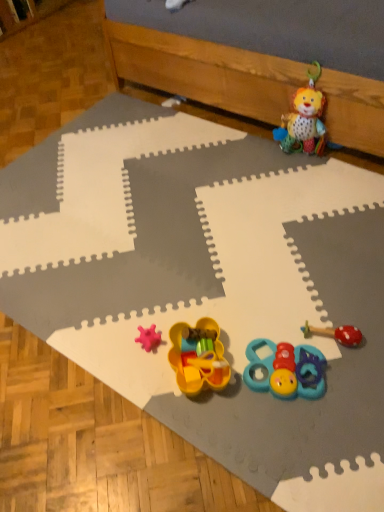
Where is `teal rubber teething toy at lower center, placed as the 1th toy when sorted from bottom to top`? teal rubber teething toy at lower center, placed as the 1th toy when sorted from bottom to top is located at coordinates (286, 370).

The height and width of the screenshot is (512, 384). I want to click on yellow plastic toy at center, which appears as the 3th toy when viewed from the top, so click(198, 357).

What do you see at coordinates (198, 357) in the screenshot? This screenshot has width=384, height=512. I see `yellow plastic toy at center, which appears as the 3th toy when viewed from the top` at bounding box center [198, 357].

Locate an element on the screen. This screenshot has height=512, width=384. teal rubber teething toy at lower center, acting as the 4th toy starting from the top is located at coordinates (286, 370).

Image resolution: width=384 pixels, height=512 pixels. I want to click on toy located above the red rubber teething ring at lower right, the 2th toy in the top-to-bottom sequence (from the image's perspective), so [x=304, y=119].

Measure the distance from plush fabric lion at upper right, the 4th toy in the front-to-back sequence, to red rubber teething ring at lower right, positioned as the third toy in bottom-to-top order.

plush fabric lion at upper right, the 4th toy in the front-to-back sequence, and red rubber teething ring at lower right, positioned as the third toy in bottom-to-top order, are 75.78 centimeters apart.

From the image's perspective, does plush fabric lion at upper right, which is the 1th toy in back-to-front order, appear lower than red rubber teething ring at lower right, the 2th toy in the top-to-bottom sequence?

No, from the image's perspective, plush fabric lion at upper right, which is the 1th toy in back-to-front order, is not beneath red rubber teething ring at lower right, the 2th toy in the top-to-bottom sequence.

Is red rubber teething ring at lower right, which is the 2th toy in back-to-front order, inside plush fabric lion at upper right, the 4th toy in the front-to-back sequence?

No.

Is yellow plastic toy at center, which appears as the 3th toy when viewed from the top, not close to teal rubber teething toy at lower center, the 3th toy when ordered from back to front?

That's not correct — yellow plastic toy at center, which appears as the 3th toy when viewed from the top, is a little close to teal rubber teething toy at lower center, the 3th toy when ordered from back to front.

Considering the positions of points (181, 374) and (269, 381), is point (181, 374) closer to camera compared to point (269, 381)?

No, it is behind (269, 381).

Which object is more forward, yellow plastic toy at center, which appears as the 3th toy when viewed from the top, or teal rubber teething toy at lower center, the 3th toy when ordered from back to front?

yellow plastic toy at center, which appears as the 3th toy when viewed from the top, is more forward.

Between yellow plastic toy at center, which appears as the 2th toy when ordered from the bottom, and teal rubber teething toy at lower center, positioned as the second toy in front-to-back order, which one has smaller width?

teal rubber teething toy at lower center, positioned as the second toy in front-to-back order, is thinner.

From a real-world perspective, which object rests below the other?

yellow plastic toy at center, which appears as the 2th toy when ordered from the bottom, from a real-world perspective.

Between point (204, 340) and point (278, 33), which one is positioned in front?

The point (204, 340) is in front.

In terms of width, does yellow plastic toy at center, which is the 4th toy from back to front, look wider or thinner when compared to wooden at upper right?

In the image, yellow plastic toy at center, which is the 4th toy from back to front, appears to be more narrow than wooden at upper right.

From the image's perspective, which object appears higher, wooden at upper right or plush fabric lion at upper right, the 1th toy viewed from the top?

wooden at upper right, from the image's perspective.

This screenshot has height=512, width=384. There is a wooden at upper right. In order to click on the 1st toy below it (from the image's perspective) in this screenshot , I will do `click(304, 119)`.

Is wooden at upper right at the left side of plush fabric lion at upper right, the 1th toy viewed from the top?

Correct, you'll find wooden at upper right to the left of plush fabric lion at upper right, the 1th toy viewed from the top.

How distant is wooden at upper right from plush fabric lion at upper right, which is the 1th toy in back-to-front order?

wooden at upper right is 9.12 inches away from plush fabric lion at upper right, which is the 1th toy in back-to-front order.

Is point (284, 127) positioned in front of point (126, 58)?

Yes, it is.

Looking at this image, considering the positions of objects plush fabric lion at upper right, which appears as the 4th toy when ordered from the bottom, and wooden at upper right in the image provided, who is more to the left, plush fabric lion at upper right, which appears as the 4th toy when ordered from the bottom, or wooden at upper right?

From the viewer's perspective, wooden at upper right appears more on the left side.

Considering the sizes of objects plush fabric lion at upper right, which is the 1th toy in back-to-front order, and wooden at upper right in the image provided, who is smaller, plush fabric lion at upper right, which is the 1th toy in back-to-front order, or wooden at upper right?

plush fabric lion at upper right, which is the 1th toy in back-to-front order, is smaller.

Considering the relative sizes of red rubber teething ring at lower right, the third toy when ordered from front to back, and wooden at upper right in the image provided, is red rubber teething ring at lower right, the third toy when ordered from front to back, thinner than wooden at upper right?

Yes.

Is red rubber teething ring at lower right, positioned as the third toy in bottom-to-top order, directly adjacent to wooden at upper right?

red rubber teething ring at lower right, positioned as the third toy in bottom-to-top order, and wooden at upper right are not in contact.

Where is `bed frame behind the red rubber teething ring at lower right, the 2th toy in the top-to-bottom sequence`? This screenshot has height=512, width=384. bed frame behind the red rubber teething ring at lower right, the 2th toy in the top-to-bottom sequence is located at coordinates (259, 57).

Is red rubber teething ring at lower right, positioned as the third toy in bottom-to-top order, at the right side of wooden at upper right?

Incorrect, red rubber teething ring at lower right, positioned as the third toy in bottom-to-top order, is not on the right side of wooden at upper right.

Considering the relative sizes of red rubber teething ring at lower right, the third toy when ordered from front to back, and teal rubber teething toy at lower center, positioned as the second toy in front-to-back order, in the image provided, is red rubber teething ring at lower right, the third toy when ordered from front to back, bigger than teal rubber teething toy at lower center, positioned as the second toy in front-to-back order,?

No.

From a real-world perspective, does red rubber teething ring at lower right, positioned as the third toy in bottom-to-top order, stand above teal rubber teething toy at lower center, positioned as the second toy in front-to-back order?

Indeed, from a real-world perspective, red rubber teething ring at lower right, positioned as the third toy in bottom-to-top order, stands above teal rubber teething toy at lower center, positioned as the second toy in front-to-back order.

From the image's perspective, count 2nd toys downward from the red rubber teething ring at lower right, which is the 2th toy in back-to-front order, and point to it. Please provide its 2D coordinates.

[(286, 370)]

Would you say red rubber teething ring at lower right, the 2th toy in the top-to-bottom sequence, is to the left or to the right of teal rubber teething toy at lower center, acting as the 4th toy starting from the top, in the picture?

Clearly, red rubber teething ring at lower right, the 2th toy in the top-to-bottom sequence, is on the right of teal rubber teething toy at lower center, acting as the 4th toy starting from the top, in the image.

This screenshot has width=384, height=512. In order to click on toy behind the red rubber teething ring at lower right, the 2th toy in the top-to-bottom sequence in this screenshot , I will do `click(304, 119)`.

This screenshot has height=512, width=384. Identify the location of toy in front of the teal rubber teething toy at lower center, acting as the 4th toy starting from the top. (198, 357).

Considering their positions, is wooden at upper right positioned further to plush fabric lion at upper right, the 1th toy viewed from the top, than teal rubber teething toy at lower center, the 3th toy when ordered from back to front?

Among the two, teal rubber teething toy at lower center, the 3th toy when ordered from back to front, is located further to plush fabric lion at upper right, the 1th toy viewed from the top.

Looking at the image, which one is located further to plush fabric lion at upper right, which is the 1th toy in back-to-front order, red rubber teething ring at lower right, positioned as the third toy in bottom-to-top order, or teal rubber teething toy at lower center, acting as the 4th toy starting from the top?

Among the two, teal rubber teething toy at lower center, acting as the 4th toy starting from the top, is located further to plush fabric lion at upper right, which is the 1th toy in back-to-front order.

Based on their spatial positions, is wooden at upper right or plush fabric lion at upper right, which is the 1th toy in back-to-front order, closer to red rubber teething ring at lower right, the third toy when ordered from front to back?

plush fabric lion at upper right, which is the 1th toy in back-to-front order.

Estimate the real-world distances between objects in this image. Which object is closer to wooden at upper right, red rubber teething ring at lower right, the 2th toy in the top-to-bottom sequence, or yellow plastic toy at center, which is the 4th toy from back to front?

red rubber teething ring at lower right, the 2th toy in the top-to-bottom sequence, is closer to wooden at upper right.

Considering their positions, is red rubber teething ring at lower right, the 2th toy in the top-to-bottom sequence, positioned closer to plush fabric lion at upper right, which is the 1th toy in back-to-front order, than yellow plastic toy at center, which appears as the 2th toy when ordered from the bottom?

red rubber teething ring at lower right, the 2th toy in the top-to-bottom sequence.

From the picture: Considering their positions, is plush fabric lion at upper right, which is the 1th toy in back-to-front order, positioned further to red rubber teething ring at lower right, the third toy when ordered from front to back, than yellow plastic toy at center, which appears as the 2th toy when ordered from the bottom?

plush fabric lion at upper right, which is the 1th toy in back-to-front order, lies further to red rubber teething ring at lower right, the third toy when ordered from front to back, than the other object.

From the picture: Looking at the image, which one is located further to yellow plastic toy at center, acting as the 1th toy starting from the front, wooden at upper right or red rubber teething ring at lower right, the third toy when ordered from front to back?

Among the two, wooden at upper right is located further to yellow plastic toy at center, acting as the 1th toy starting from the front.

Based on their spatial positions, is yellow plastic toy at center, which is the 4th toy from back to front, or plush fabric lion at upper right, which is the 1th toy in back-to-front order, closer to wooden at upper right?

Based on the image, plush fabric lion at upper right, which is the 1th toy in back-to-front order, appears to be nearer to wooden at upper right.

Identify the location of toy between yellow plastic toy at center, which appears as the 2th toy when ordered from the bottom, and red rubber teething ring at lower right, which is the 2th toy in back-to-front order. (286, 370).

The width and height of the screenshot is (384, 512). Find the location of `toy between wooden at upper right and red rubber teething ring at lower right, which is the 2th toy in back-to-front order, vertically`. toy between wooden at upper right and red rubber teething ring at lower right, which is the 2th toy in back-to-front order, vertically is located at coordinates (304, 119).

Locate an element on the screen. This screenshot has height=512, width=384. toy between plush fabric lion at upper right, which is the 1th toy in back-to-front order, and yellow plastic toy at center, which appears as the 3th toy when viewed from the top, from top to bottom is located at coordinates (336, 334).